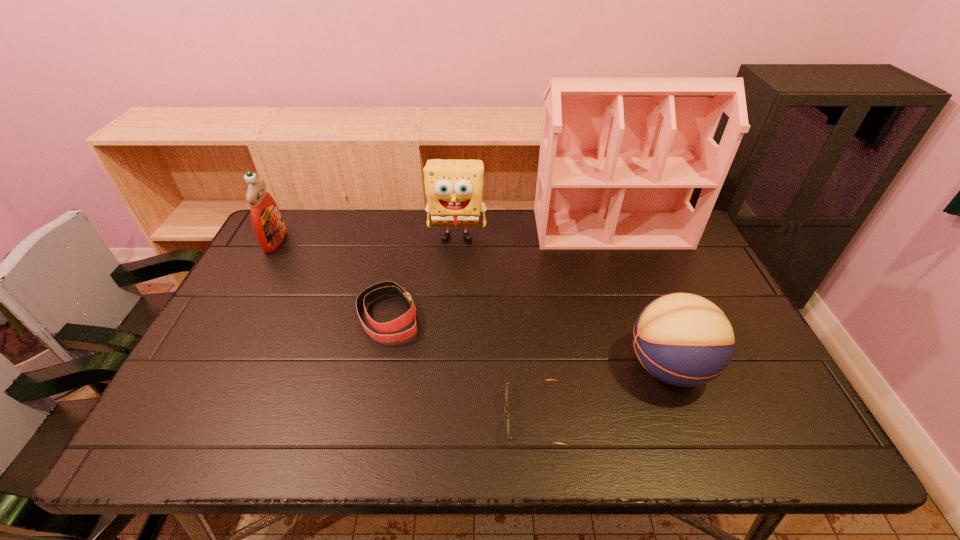
This screenshot has width=960, height=540. What are the coordinates of `the tallest object` in the screenshot? It's located at (619, 159).

Where is `sponge`? The width and height of the screenshot is (960, 540). sponge is located at coordinates (x=454, y=188).

Identify the location of the leftmost object. The height and width of the screenshot is (540, 960). (267, 221).

Locate an element on the screen. The width and height of the screenshot is (960, 540). basketball is located at coordinates (682, 339).

You are a GUI agent. You are given a task and a screenshot of the screen. Output one action in this format:
    pyautogui.click(x=<x>, y=<y>)
    Task: Click on the dog collar
    
    Given the screenshot: What is the action you would take?
    pyautogui.click(x=384, y=288)

Image resolution: width=960 pixels, height=540 pixels. Identify the location of the shortest object. click(506, 391).

Where is `free space located on the front-facing side of the tallest object`? This screenshot has width=960, height=540. free space located on the front-facing side of the tallest object is located at coordinates (645, 324).

The width and height of the screenshot is (960, 540). In order to click on vacant space located 0.320m on the face of the sponge in this screenshot , I will do `click(451, 325)`.

Find the location of a particular element. The width and height of the screenshot is (960, 540). vacant space located on the front surface of the detergent is located at coordinates (354, 241).

Locate an element on the screen. This screenshot has width=960, height=540. vacant region located 0.300m on the patterned surface of the fourth tallest object is located at coordinates (504, 367).